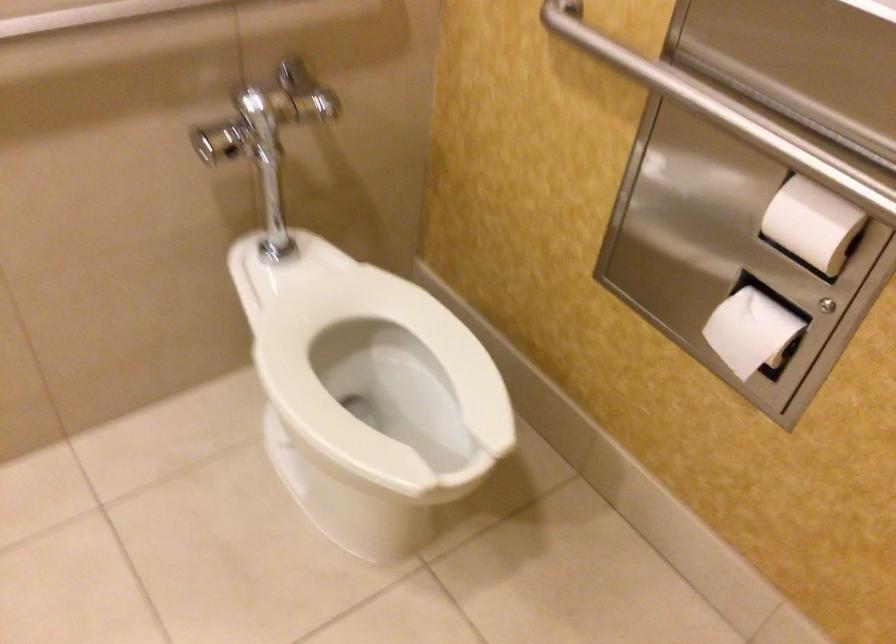
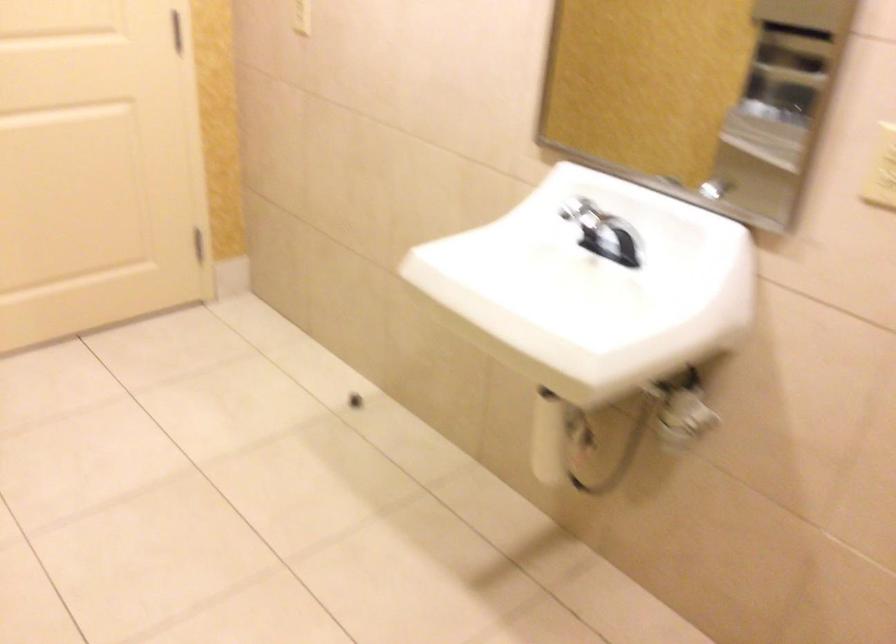
Question: The camera is either moving clockwise (left) or counter-clockwise (right) around the object. The first image is from the beginning of the video and the second image is from the end. Is the camera moving left or right when shooting the video?

Choices:
 (A) Left
 (B) Right

Answer: (B)